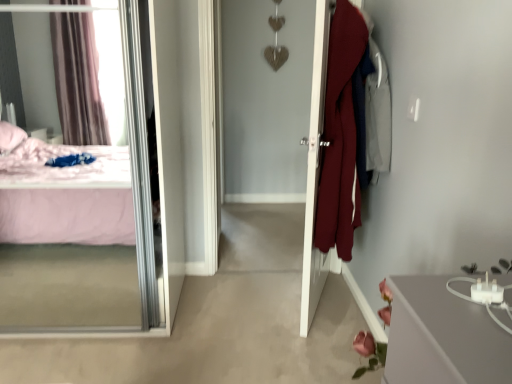
Question: In terms of size, does transparent glass mirror at left appear bigger or smaller than white glossy door at center?

Choices:
 (A) big
 (B) small

Answer: (A)

Question: From a real-world perspective, relative to white glossy door at center, is transparent glass mirror at left vertically above or below?

Choices:
 (A) below
 (B) above

Answer: (A)

Question: Does point (62, 173) appear closer or farther from the camera than point (337, 16)?

Choices:
 (A) closer
 (B) farther

Answer: (B)

Question: Is point (323, 248) closer or farther from the camera than point (36, 23)?

Choices:
 (A) closer
 (B) farther

Answer: (A)

Question: From a real-world perspective, is white glossy door at center positioned above or below transparent glass mirror at left?

Choices:
 (A) above
 (B) below

Answer: (A)

Question: In terms of width, does white glossy door at center look wider or thinner when compared to transparent glass mirror at left?

Choices:
 (A) wide
 (B) thin

Answer: (B)

Question: Considering the positions of white glossy door at center and transparent glass mirror at left in the image, is white glossy door at center taller or shorter than transparent glass mirror at left?

Choices:
 (A) tall
 (B) short

Answer: (A)